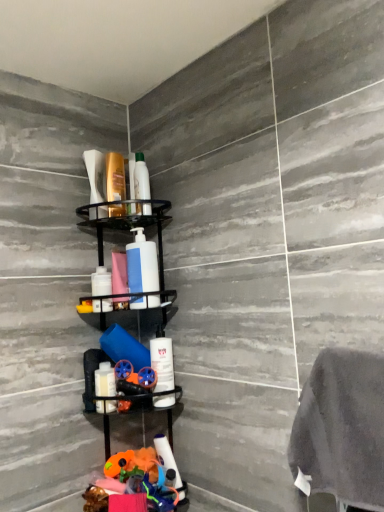
Question: Is black matte shelf at center completely or partially outside of white matte pump bottle at center?

Choices:
 (A) no
 (B) yes

Answer: (B)

Question: From the image's perspective, is black matte shelf at center below white matte pump bottle at center?

Choices:
 (A) yes
 (B) no

Answer: (A)

Question: Does black matte shelf at center have a larger size compared to white matte pump bottle at center?

Choices:
 (A) no
 (B) yes

Answer: (B)

Question: Is white matte pump bottle at center inside black matte shelf at center?

Choices:
 (A) yes
 (B) no

Answer: (A)

Question: From a real-world perspective, is black matte shelf at center physically below white matte pump bottle at center?

Choices:
 (A) yes
 (B) no

Answer: (A)

Question: In terms of width, does black matte shelf at center look wider or thinner when compared to matte white soap dispenser at upper left, marked as the 2th toiletry in a top-to-bottom arrangement?

Choices:
 (A) thin
 (B) wide

Answer: (B)

Question: Is black matte shelf at center in front of or behind matte white soap dispenser at upper left, marked as the 2th toiletry in a top-to-bottom arrangement, in the image?

Choices:
 (A) front
 (B) behind

Answer: (A)

Question: Is black matte shelf at center situated inside matte white soap dispenser at upper left, positioned as the 4th toiletry in bottom-to-top order, or outside?

Choices:
 (A) outside
 (B) inside

Answer: (A)

Question: From their relative heights in the image, would you say black matte shelf at center is taller or shorter than matte white soap dispenser at upper left, marked as the 2th toiletry in a top-to-bottom arrangement?

Choices:
 (A) short
 (B) tall

Answer: (B)

Question: Considering the positions of white glossy bottle at lower left, marked as the 5th toiletry in a top-to-bottom arrangement, and black matte shelf at center in the image, is white glossy bottle at lower left, marked as the 5th toiletry in a top-to-bottom arrangement, taller or shorter than black matte shelf at center?

Choices:
 (A) short
 (B) tall

Answer: (A)

Question: Does point (99, 375) appear closer or farther from the camera than point (158, 290)?

Choices:
 (A) farther
 (B) closer

Answer: (B)

Question: Considering the relative positions of white glossy bottle at lower left, marked as the 5th toiletry in a top-to-bottom arrangement, and black matte shelf at center in the image provided, is white glossy bottle at lower left, marked as the 5th toiletry in a top-to-bottom arrangement, to the left or to the right of black matte shelf at center?

Choices:
 (A) right
 (B) left

Answer: (B)

Question: In terms of width, does white glossy bottle at lower left, marked as the 5th toiletry in a top-to-bottom arrangement, look wider or thinner when compared to black matte shelf at center?

Choices:
 (A) thin
 (B) wide

Answer: (A)

Question: From their relative heights in the image, would you say black matte shelf at center is taller or shorter than white matte pump bottle at center?

Choices:
 (A) short
 (B) tall

Answer: (B)

Question: Which is correct: black matte shelf at center is inside white matte pump bottle at center, or outside of it?

Choices:
 (A) outside
 (B) inside

Answer: (A)